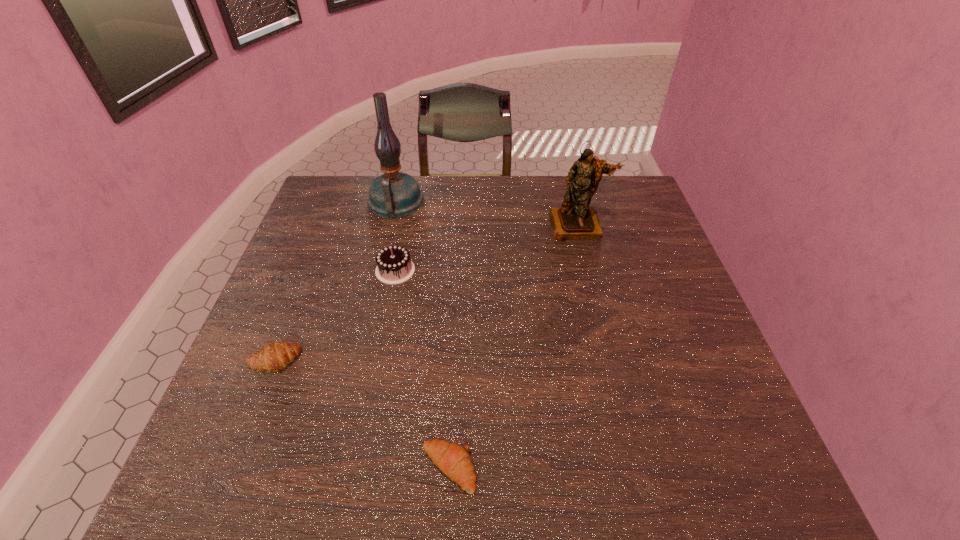
Find the location of a particular element. free space between the fourth object from left to right and the tallest object is located at coordinates (422, 335).

Where is `free space between the second nearest object and the chocolate cake`? free space between the second nearest object and the chocolate cake is located at coordinates (334, 316).

Locate an element on the screen. The image size is (960, 540). empty space that is in between the tallest object and the third farthest object is located at coordinates (396, 236).

Identify the location of free space between the figurine and the tallest object. (487, 214).

I want to click on free space between the third farthest object and the rightmost object, so [x=487, y=248].

I want to click on object that is the fourth closest to the third farthest object, so click(x=453, y=460).

The height and width of the screenshot is (540, 960). Find the location of `the closest object relative to the third tallest object`. the closest object relative to the third tallest object is located at coordinates (394, 194).

Find the location of a particular element. The height and width of the screenshot is (540, 960). vacant region that satisfies the following two spatial constraints: 1. on the front side of the oil lamp; 2. on the right side of the right crescent roll is located at coordinates (334, 468).